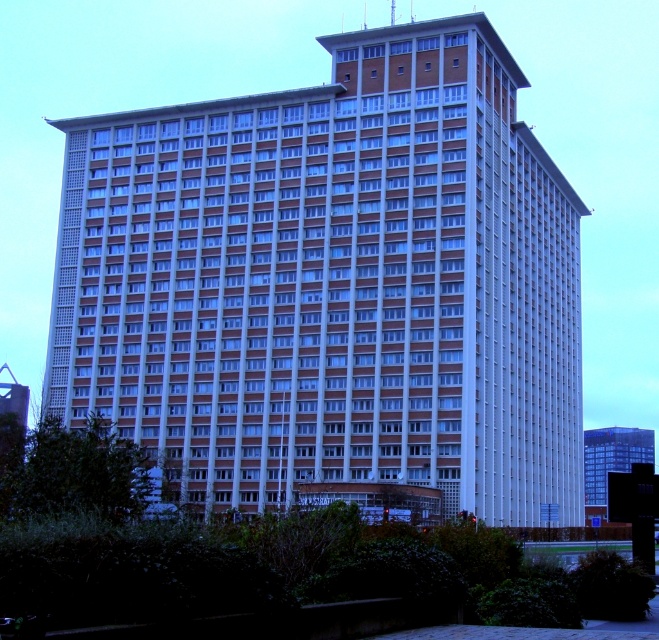
You are standing on the ground floor of the building and want to look up at the white brick building at center and the glassy blue skyscraper at center. Which one is higher from your viewpoint?

The white brick building at center is located above the glassy blue skyscraper at center, so the white brick building at center is higher from your viewpoint.

You are standing at a point 82.55 meters away from the building. The building has a modern design with a reddish brick lower section and white upper panels. There is a point marked at coordinates point (115, 291). If you were to walk directly toward the building, would you first encounter the reddish brick section or the white panels?

The point (115, 291) is located on the building. Since the lower sections have reddish brick and upper sections have white panels, the first part of the building you encounter when approaching would be the reddish brick section, so yes, you would first encounter the reddish brick section.

You are standing on the sidewalk in front of the white brick building at center and the glassy blue skyscraper at center. Which building do you see first as you look up from the ground?

The white brick building at center is closer to the viewer than the glassy blue skyscraper at center, so you will see the white brick building at center first when looking up from the ground.